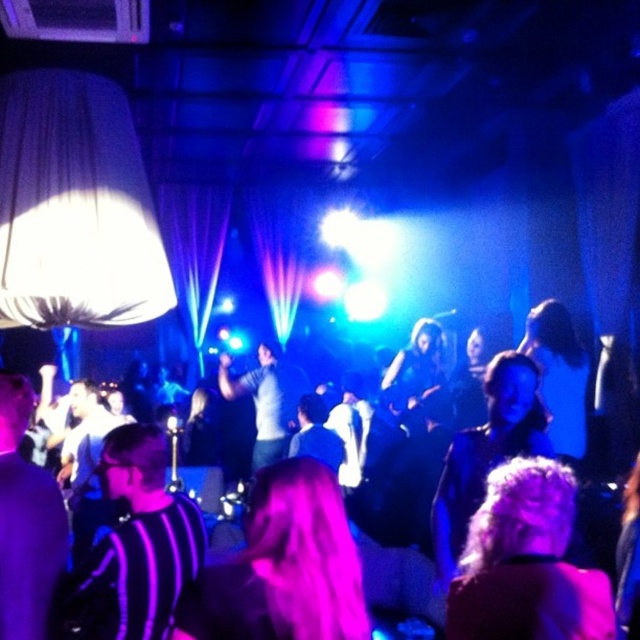
Question: Considering the relative positions of curly hair at center and dark gray shirt at center in the image provided, where is curly hair at center located with respect to dark gray shirt at center?

Choices:
 (A) left
 (B) right

Answer: (B)

Question: Among these objects, which one is nearest to the camera?

Choices:
 (A) striped fabric shirt at center
 (B) black striped shirt at lower left
 (C) curly hair at center
 (D) dark gray shirt at center

Answer: (C)

Question: Does curly hair at center have a smaller size compared to dark gray shirt at center?

Choices:
 (A) yes
 (B) no

Answer: (A)

Question: Which object is farther from the camera taking this photo?

Choices:
 (A) curly hair at center
 (B) black striped shirt at lower left

Answer: (B)

Question: Which point is farther from the camera taking this photo?

Choices:
 (A) (220, 378)
 (B) (132, 518)

Answer: (A)

Question: Is black striped shirt at lower left wider than dark gray shirt at center?

Choices:
 (A) no
 (B) yes

Answer: (A)